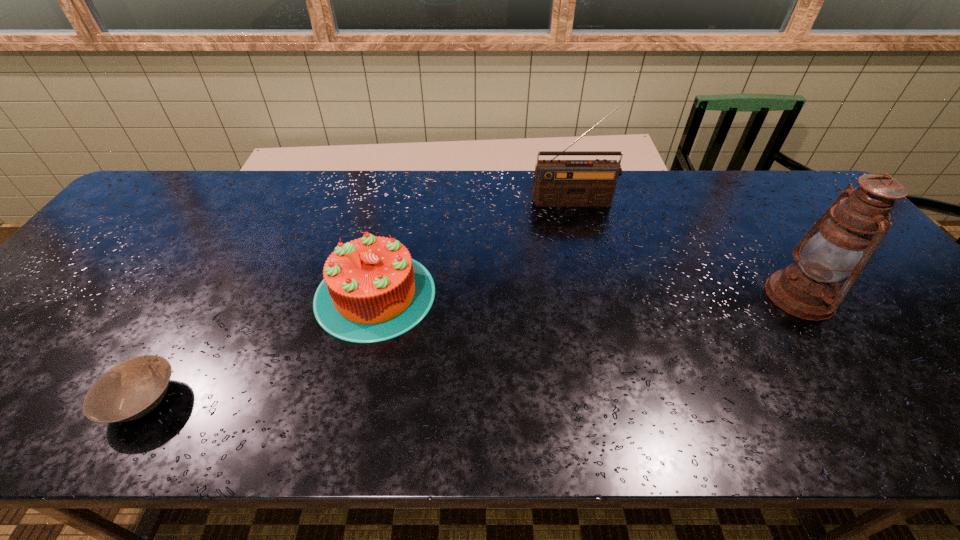
The height and width of the screenshot is (540, 960). What are the coordinates of `the farthest object` in the screenshot? It's located at (556, 182).

Where is `the third object from left to right`? the third object from left to right is located at coordinates (556, 182).

Where is `oil lamp`? This screenshot has height=540, width=960. oil lamp is located at coordinates (860, 218).

Image resolution: width=960 pixels, height=540 pixels. Find the location of `the second shortest object`. the second shortest object is located at coordinates [x=372, y=291].

Find the location of a particular element. Image resolution: width=960 pixels, height=540 pixels. the third object from right to left is located at coordinates (372, 291).

What are the coordinates of `the shortest object` in the screenshot? It's located at (130, 390).

Where is `bowl`? The width and height of the screenshot is (960, 540). bowl is located at coordinates (130, 390).

Find the location of a particular element. vacant space situated 0.190m on the front-facing side of the radio receiver is located at coordinates (588, 248).

The height and width of the screenshot is (540, 960). I want to click on free space located on the front of the oil lamp, so click(837, 352).

Locate an element on the screen. free spot located on the right of the cake is located at coordinates [x=582, y=294].